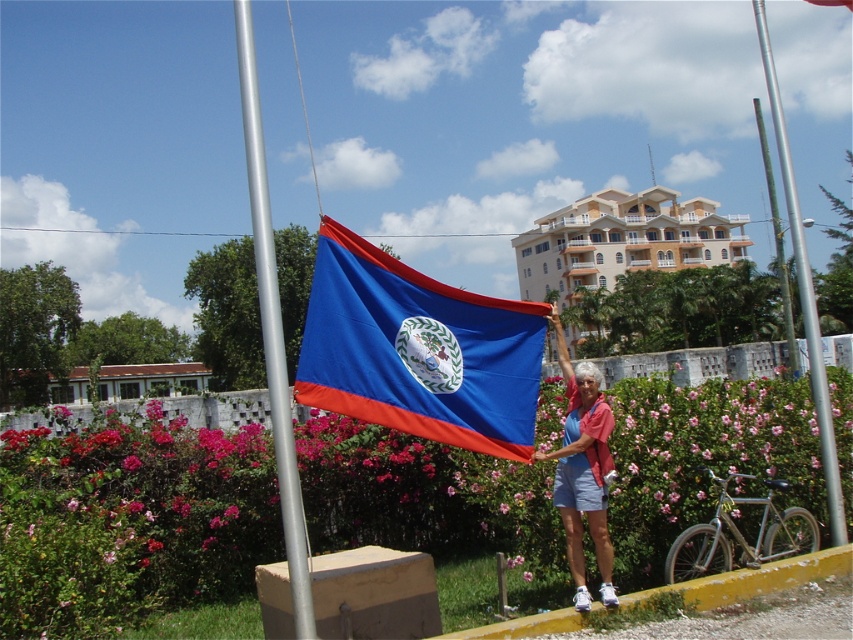
Is matte blue shorts at center wider than silver metallic pole at center?

No.

Which is behind, point (589, 384) or point (833, 492)?

The point (833, 492) is behind.

The width and height of the screenshot is (853, 640). I want to click on matte blue shorts at center, so click(x=583, y=472).

Does blue fabric flag at center appear on the left side of silver metallic pole at center?

Correct, you'll find blue fabric flag at center to the left of silver metallic pole at center.

At what (x,y) coordinates should I click in order to perform the action: click on blue fabric flag at center. Please return your answer as a coordinate pair (x, y). This screenshot has width=853, height=640. Looking at the image, I should click on (418, 349).

Is point (421, 324) positioned before point (822, 406)?

Yes, it is in front of point (822, 406).

Locate an element on the screen. The image size is (853, 640). blue fabric flag at center is located at coordinates (418, 349).

Looking at this image, can you confirm if silver metallic flag pole at left is positioned to the left of silver metallic pole at center?

Yes, silver metallic flag pole at left is to the left of silver metallic pole at center.

Looking at this image, can you confirm if silver metallic flag pole at left is positioned to the right of silver metallic pole at center?

In fact, silver metallic flag pole at left is to the left of silver metallic pole at center.

Is point (257, 212) less distant than point (814, 371)?

Yes, point (257, 212) is in front of point (814, 371).

Find the location of `silver metallic flag pole at left`. silver metallic flag pole at left is located at coordinates (271, 330).